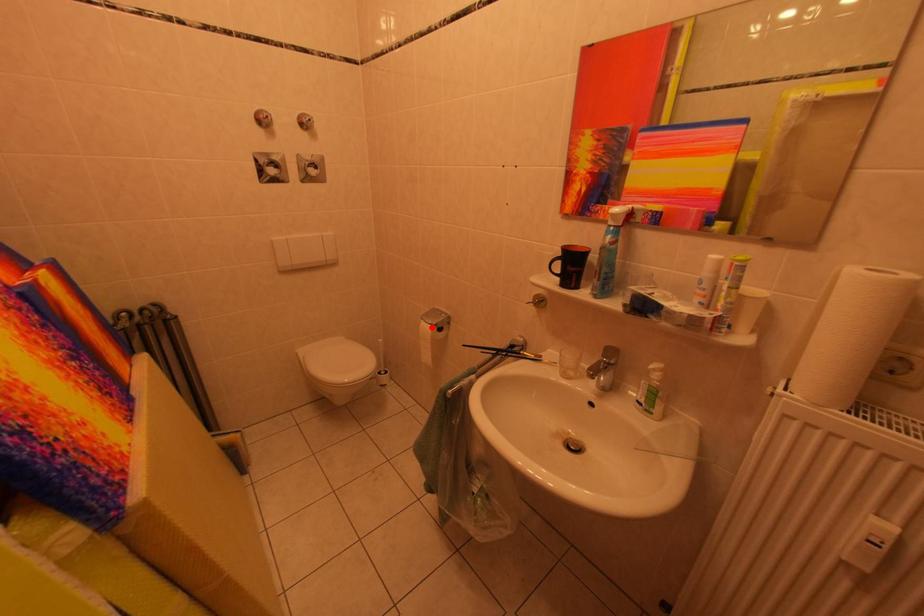
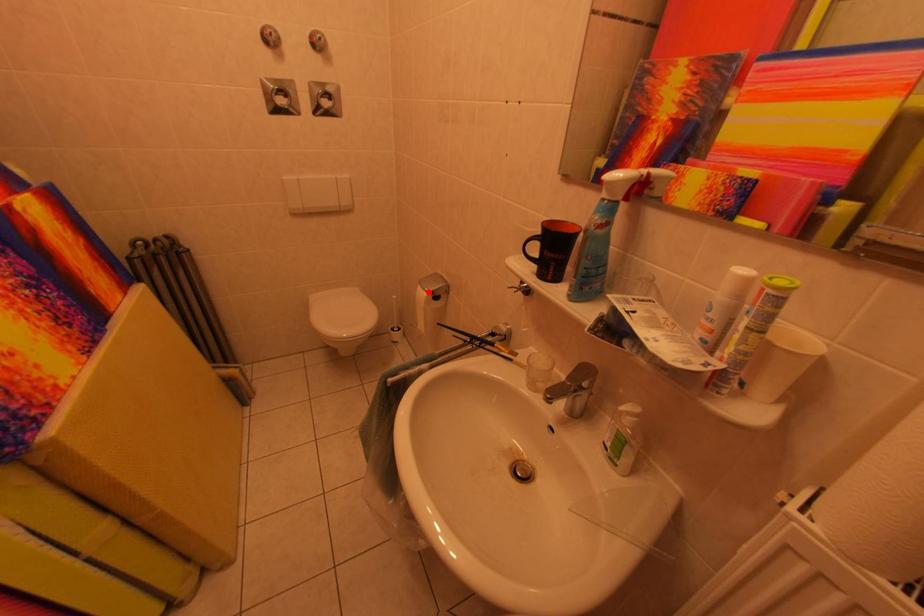
I am providing you with two images of the same scene from different viewpoints. A red point is marked on the first image and another point is marked on the second image. Is the red point in image1 aligned with the point shown in image2?

Yes